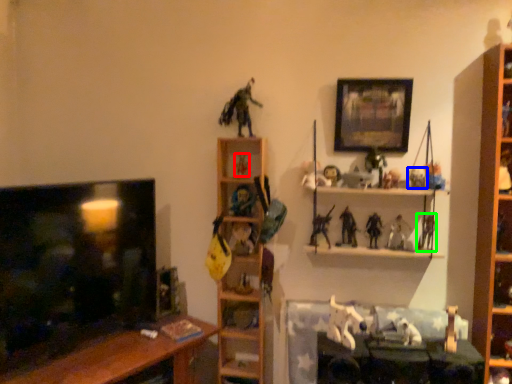
Question: Considering the real-world distances, which object is farthest from toy (highlighted by a red box)? toy (highlighted by a blue box) or toy (highlighted by a green box)?

Choices:
 (A) toy
 (B) toy

Answer: (B)